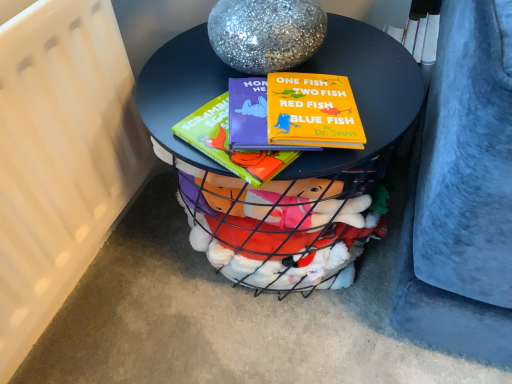
Question: Considering their positions, is matte black table at center located in front of or behind white matte radiator at left?

Choices:
 (A) front
 (B) behind

Answer: (B)

Question: Is matte black table at center to the left or to the right of white matte radiator at left in the image?

Choices:
 (A) right
 (B) left

Answer: (A)

Question: Based on their sizes in the image, would you say matte black table at center is bigger or smaller than white matte radiator at left?

Choices:
 (A) small
 (B) big

Answer: (B)

Question: In the image, is white matte radiator at left positioned in front of or behind matte black table at center?

Choices:
 (A) front
 (B) behind

Answer: (A)

Question: From the image's perspective, is white matte radiator at left located above or below matte black table at center?

Choices:
 (A) above
 (B) below

Answer: (A)

Question: In terms of width, does white matte radiator at left look wider or thinner when compared to matte black table at center?

Choices:
 (A) thin
 (B) wide

Answer: (A)

Question: From a real-world perspective, relative to matte black table at center, is white matte radiator at left vertically above or below?

Choices:
 (A) above
 (B) below

Answer: (A)